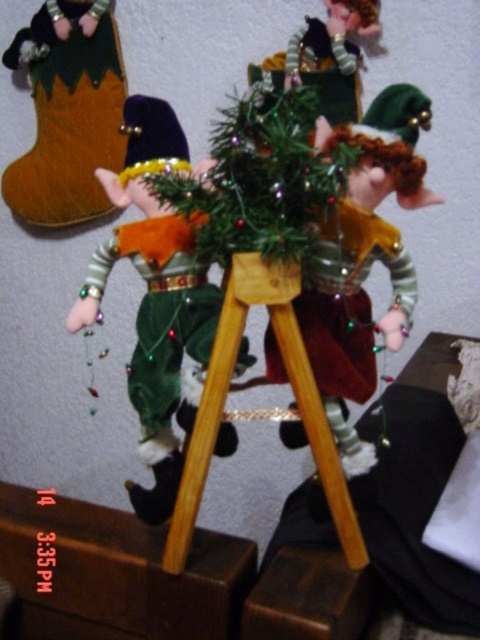
You are setting up a display and need to place a small ornament exactly at the coordinates mentioned for the velvet green elf at center. What is the exact coordinate where you should place the ornament?

The velvet green elf at center is located at point (364, 262), so you should place the ornament at those exact coordinates.

You are setting up a holiday display and want to place the velvet green elf at center and the green velvet christmas tree at center on a shelf. The shelf has a width of 10 centimeters. Can both items fit side by side without overlapping?

The velvet green elf at center and green velvet christmas tree at center are 9.26 centimeters apart from each other. Since the shelf is 10 centimeters wide, there is enough space for both items to fit side by side without overlapping.

You are an elf figure in the festive scene. You want to move to the point marked at coordinate (364,262). Which elf should you move from to reach that point?

The velvet green elf at center is located at point (364,262), so you should move from the other elf to reach that point.